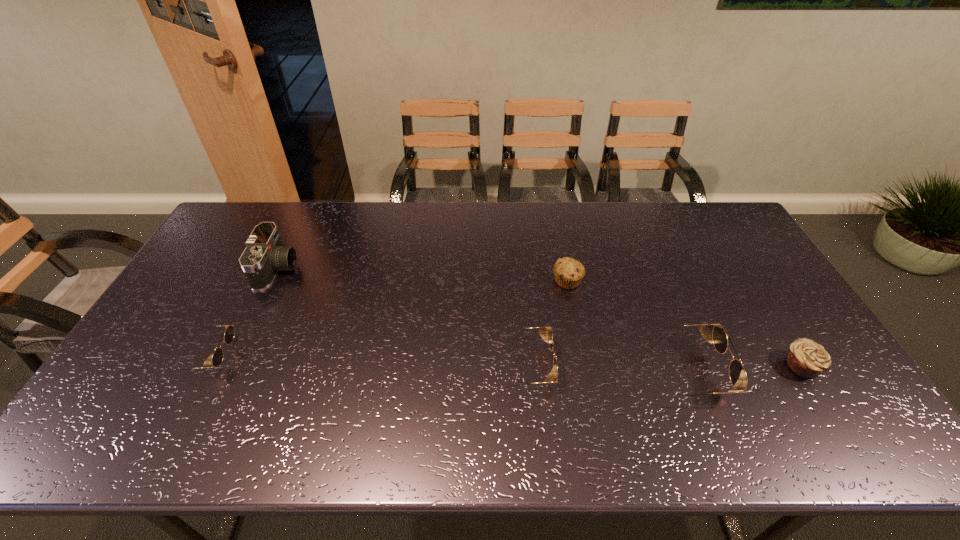
I want to click on free space that is in between the camera and the rightmost sunglasses, so click(x=481, y=320).

Locate an element on the screen. This screenshot has width=960, height=540. blank region between the fourth object from right to left and the shortest sunglasses is located at coordinates (365, 361).

This screenshot has height=540, width=960. I want to click on free space between the third object from right to left and the rightmost sunglasses, so click(x=626, y=326).

At what (x,y) coordinates should I click in order to perform the action: click on free spot between the rightmost object and the camera. Please return your answer as a coordinate pair (x, y). This screenshot has height=540, width=960. Looking at the image, I should click on (540, 318).

You are a GUI agent. You are given a task and a screenshot of the screen. Output one action in this format:
    pyautogui.click(x=<x>, y=<y>)
    Task: Click on the free space between the camera and the second object from right to left
    Image resolution: width=960 pixels, height=540 pixels.
    Given the screenshot: What is the action you would take?
    pyautogui.click(x=481, y=320)

This screenshot has height=540, width=960. Find the location of `vacant area between the rightmost sunglasses and the shortest sunglasses`. vacant area between the rightmost sunglasses and the shortest sunglasses is located at coordinates (446, 363).

Locate which object is the fourth closest to the rightmost object. Please provide its 2D coordinates. Your answer should be formatted as a tuple, i.e. [(x, y)], where the tuple contains the x and y coordinates of a point satisfying the conditions above.

[(264, 255)]

Find the location of a particular element. object that is the closest to the second sunglasses from left to right is located at coordinates (568, 273).

Point out which sunglasses is positioned as the second nearest to the leftmost sunglasses. Please provide its 2D coordinates. Your answer should be formatted as a tuple, i.e. [(x, y)], where the tuple contains the x and y coordinates of a point satisfying the conditions above.

[(737, 373)]

Locate which sunglasses is the third closest to the rightmost object. Please provide its 2D coordinates. Your answer should be formatted as a tuple, i.e. [(x, y)], where the tuple contains the x and y coordinates of a point satisfying the conditions above.

[(217, 358)]